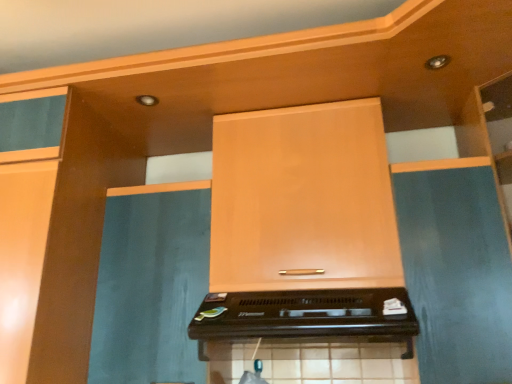
Identify the location of matte wood cabinet at center. The width and height of the screenshot is (512, 384). (303, 200).

This screenshot has height=384, width=512. Describe the element at coordinates (303, 200) in the screenshot. I see `matte wood cabinet at center` at that location.

Locate an element on the screen. The image size is (512, 384). black plastic toaster at center is located at coordinates (306, 316).

The height and width of the screenshot is (384, 512). What do you see at coordinates (306, 316) in the screenshot? I see `black plastic toaster at center` at bounding box center [306, 316].

Measure the distance between black plastic toaster at center and camera.

black plastic toaster at center is 3.44 feet away from camera.

Where is `matte wood cabinet at center`? matte wood cabinet at center is located at coordinates (303, 200).

From the picture: Is black plastic toaster at center to the right of matte wood cabinet at center from the viewer's perspective?

In fact, black plastic toaster at center is to the left of matte wood cabinet at center.

Is black plastic toaster at center closer to the viewer compared to matte wood cabinet at center?

That is True.

Between point (359, 305) and point (349, 199), which one is positioned in front?

The point (359, 305) is more forward.

From the image's perspective, between black plastic toaster at center and matte wood cabinet at center, which one is located above?

matte wood cabinet at center appears higher in the image.

From a real-world perspective, which object rests below the other?

black plastic toaster at center, from a real-world perspective.

Based on the photo, which object is wider, black plastic toaster at center or matte wood cabinet at center?

Wider between the two is black plastic toaster at center.

Does black plastic toaster at center have a lesser height compared to matte wood cabinet at center?

Correct, black plastic toaster at center is not as tall as matte wood cabinet at center.

Between black plastic toaster at center and matte wood cabinet at center, which one has larger size?

With larger size is matte wood cabinet at center.

Is black plastic toaster at center situated inside matte wood cabinet at center or outside?

black plastic toaster at center is located beyond the bounds of matte wood cabinet at center.

From the picture: Is black plastic toaster at center positioned far away from matte wood cabinet at center?

No, black plastic toaster at center is in close proximity to matte wood cabinet at center.

Is matte wood cabinet at center at the back of black plastic toaster at center?

No, black plastic toaster at center is not facing the opposite direction of matte wood cabinet at center.

What's the angular difference between black plastic toaster at center and matte wood cabinet at center's facing directions?

They differ by 1.22 degrees in their facing directions.

Where is `cabinetry that is behind the black plastic toaster at center`? cabinetry that is behind the black plastic toaster at center is located at coordinates (303, 200).

Which object is positioned more to the right, matte wood cabinet at center or black plastic toaster at center?

matte wood cabinet at center is more to the right.

Is matte wood cabinet at center closer to camera compared to black plastic toaster at center?

No, matte wood cabinet at center is further to the viewer.

Which is in front, point (240, 246) or point (258, 294)?

Point (258, 294)

From the image's perspective, which is above, matte wood cabinet at center or black plastic toaster at center?

matte wood cabinet at center is shown above in the image.

From a real-world perspective, who is located higher, matte wood cabinet at center or black plastic toaster at center?

matte wood cabinet at center is physically above.

Is matte wood cabinet at center thinner than black plastic toaster at center?

Indeed, matte wood cabinet at center has a lesser width compared to black plastic toaster at center.

In the scene shown: Who is shorter, matte wood cabinet at center or black plastic toaster at center?

black plastic toaster at center.

Which of these two, matte wood cabinet at center or black plastic toaster at center, is bigger?

matte wood cabinet at center.

Can we say matte wood cabinet at center lies outside black plastic toaster at center?

matte wood cabinet at center is positioned outside black plastic toaster at center.

Is matte wood cabinet at center far from black plastic toaster at center?

matte wood cabinet at center is near black plastic toaster at center, not far away.

Is matte wood cabinet at center positioned with its back to black plastic toaster at center?

matte wood cabinet at center does not have its back to black plastic toaster at center.

Measure the distance between matte wood cabinet at center and black plastic toaster at center.

They are 10.32 inches apart.

Where is `appliance below the matte wood cabinet at center (from a real-world perspective)`? appliance below the matte wood cabinet at center (from a real-world perspective) is located at coordinates (306, 316).

Where is `cabinetry located above the black plastic toaster at center (from a real-world perspective)`? cabinetry located above the black plastic toaster at center (from a real-world perspective) is located at coordinates (303, 200).

Where is `appliance in front of the matte wood cabinet at center`? Image resolution: width=512 pixels, height=384 pixels. appliance in front of the matte wood cabinet at center is located at coordinates (306, 316).